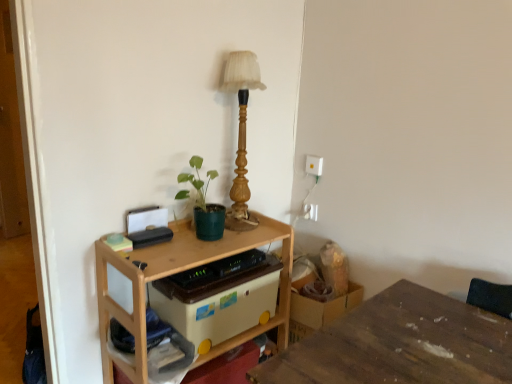
Find the location of a particular element. The width and height of the screenshot is (512, 384). blank area beneath wooden table lamp at upper center (from a real-world perspective) is located at coordinates (242, 226).